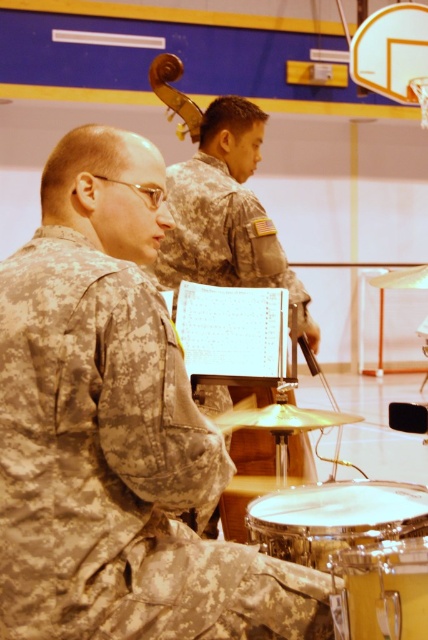
Question: Does camouflage fabric uniform at left appear on the left side of yellow drum at lower right?

Choices:
 (A) yes
 (B) no

Answer: (A)

Question: Is camouflage fabric uniform at left to the left of yellow drum at lower right from the viewer's perspective?

Choices:
 (A) no
 (B) yes

Answer: (B)

Question: Estimate the real-world distances between objects in this image. Which object is closer to the camouflage uniform at left?

Choices:
 (A) camouflage fabric uniform at left
 (B) shiny silver drum at center
 (C) yellow drum at lower right

Answer: (B)

Question: Which point appears closest to the camera in this image?

Choices:
 (A) (410, 545)
 (B) (27, 618)
 (C) (323, 532)

Answer: (B)

Question: Can you confirm if camouflage uniform at left is positioned to the right of shiny silver drum at center?

Choices:
 (A) no
 (B) yes

Answer: (A)

Question: Estimate the real-world distances between objects in this image. Which object is farther from the yellow drum at lower right?

Choices:
 (A) camouflage uniform at left
 (B) shiny silver drum at center
 (C) camouflage fabric uniform at left

Answer: (C)